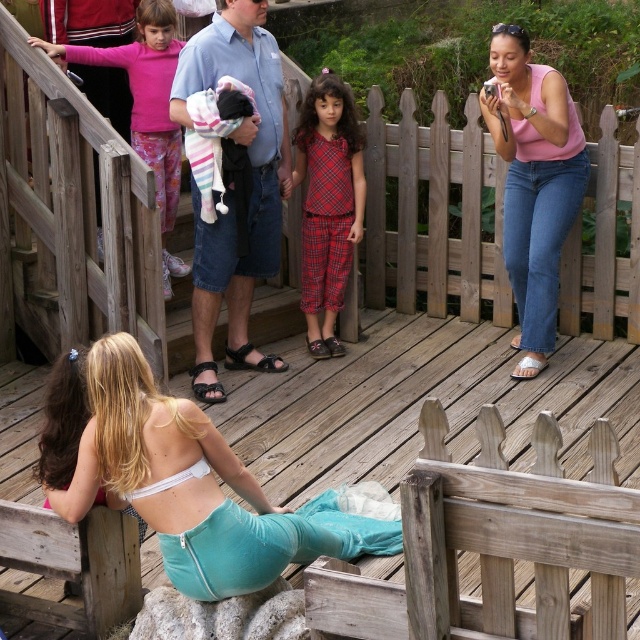
You are a photographer trying to capture a candid shot of the light blue denim shorts at center and plaid fabric pajamas at center. Based on their heights, which one would you need to adjust your camera angle upwards to focus on?

The light blue denim shorts at center is much taller than plaid fabric pajamas at center, so you would need to adjust your camera angle upwards to focus on the light blue denim shorts at center.

You are a photographer trying to capture a candid shot of the light blue denim shorts at center and the plaid fabric pajamas at center. Based on their positions, which clothing item is positioned higher in the frame?

The light blue denim shorts at center is above plaid fabric pajamas at center, so the light blue denim shorts at center is positioned higher in the frame.